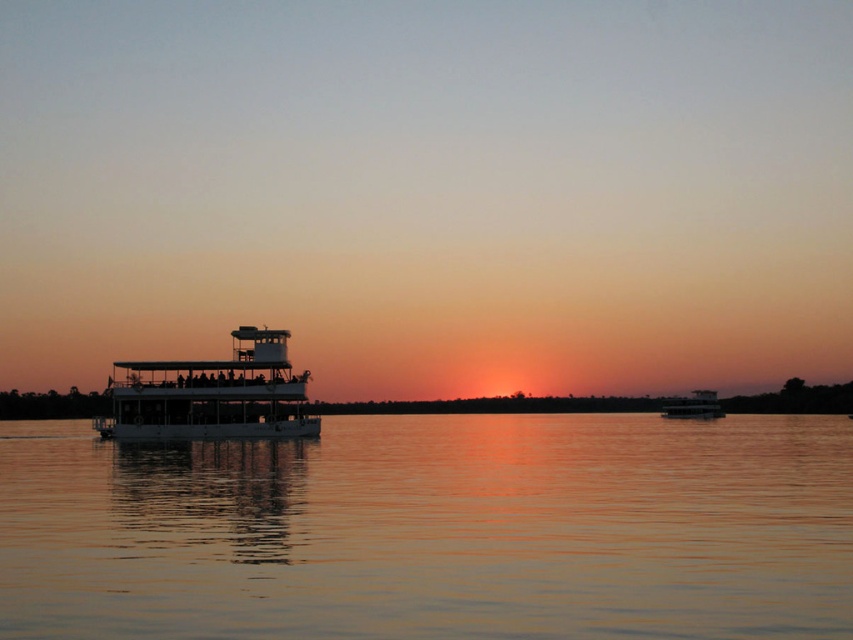
Who is taller, smooth water at center or white glossy boat at center?

With more height is smooth water at center.

I want to click on smooth water at center, so click(x=433, y=529).

The image size is (853, 640). Identify the location of smooth water at center. (433, 529).

Who is taller, white matte boat at center or white glossy boat at center?

white matte boat at center is taller.

Does point (177, 396) come closer to viewer compared to point (672, 401)?

Yes, it is in front of point (672, 401).

Is point (282, 432) more distant than point (689, 406)?

No.

Identify the location of white matte boat at center. This screenshot has height=640, width=853. (212, 394).

Is point (287, 570) farther from camera compared to point (107, 432)?

No, (287, 570) is in front of (107, 432).

Between smooth water at center and white matte boat at center, which one appears on the right side from the viewer's perspective?

smooth water at center is more to the right.

Is point (815, 444) farther from camera compared to point (123, 432)?

No, (815, 444) is in front of (123, 432).

This screenshot has height=640, width=853. I want to click on smooth water at center, so click(x=433, y=529).